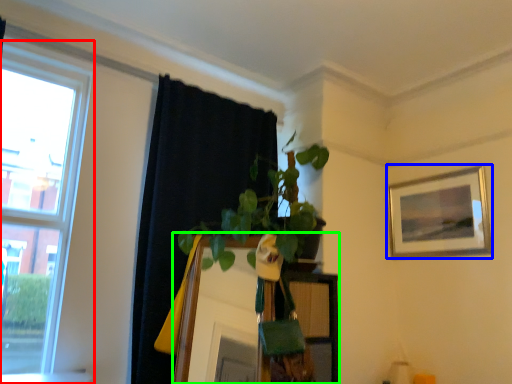
Question: Which is farther away from window (highlighted by a red box)? picture frame (highlighted by a blue box) or mirror (highlighted by a green box)?

Choices:
 (A) picture frame
 (B) mirror

Answer: (A)